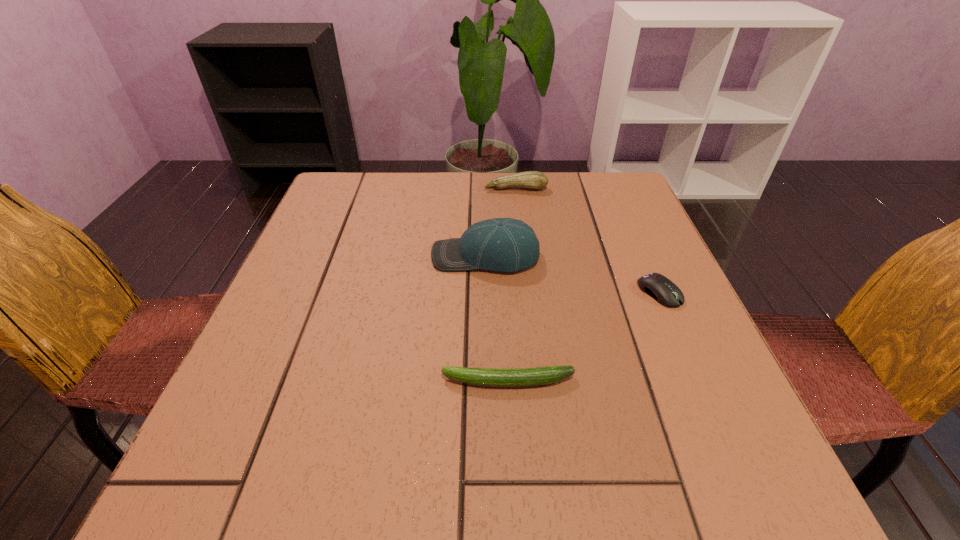
Identify the location of free space at the far right corner of the desktop. (636, 202).

At what (x,y) coordinates should I click in order to perform the action: click on vacant space that's between the taller zucchini and the shorter zucchini. Please return your answer as a coordinate pair (x, y). This screenshot has width=960, height=540. Looking at the image, I should click on (512, 285).

The width and height of the screenshot is (960, 540). Find the location of `free area in between the baseball cap and the second nearest object`. free area in between the baseball cap and the second nearest object is located at coordinates (573, 274).

This screenshot has width=960, height=540. Find the location of `blank region between the rightmost object and the third nearest object`. blank region between the rightmost object and the third nearest object is located at coordinates (573, 274).

Identify the location of empty space that is in between the third nearest object and the nearer zucchini. This screenshot has height=540, width=960. (497, 319).

The width and height of the screenshot is (960, 540). Find the location of `vacant space in between the shorter zucchini and the computer equipment`. vacant space in between the shorter zucchini and the computer equipment is located at coordinates (584, 337).

You are a GUI agent. You are given a task and a screenshot of the screen. Output one action in this format:
    pyautogui.click(x=<x>, y=<y>)
    Task: Click on the vacant point located between the rightmost object and the third nearest object
    This screenshot has width=960, height=540.
    Given the screenshot: What is the action you would take?
    pyautogui.click(x=573, y=274)

Find the location of `vacant region between the second tallest object and the rightmost object`. vacant region between the second tallest object and the rightmost object is located at coordinates (588, 240).

Where is `free space between the taller zucchini and the shorter zucchini`? The height and width of the screenshot is (540, 960). free space between the taller zucchini and the shorter zucchini is located at coordinates (512, 285).

Identify which object is located as the nearest to the nearer zucchini. Please provide its 2D coordinates. Your answer should be formatted as a tuple, i.e. [(x, y)], where the tuple contains the x and y coordinates of a point satisfying the conditions above.

[(664, 291)]